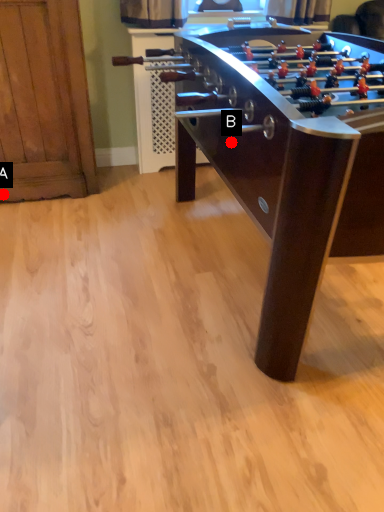
Question: Two points are circled on the image, labeled by A and B beside each circle. Which of the following is the farthest from the observer?

Choices:
 (A) A is further
 (B) B is further

Answer: (A)